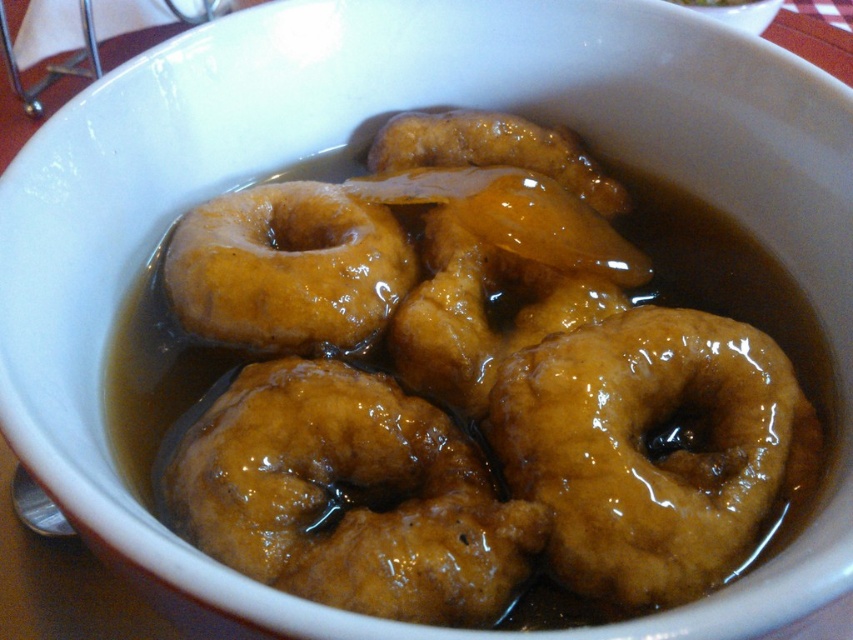
Question: Which object appears closest to the camera in this image?

Choices:
 (A) golden brown glazed donut at center
 (B) glossy golden donut at center

Answer: (B)

Question: Based on their relative distances, which object is nearer to the glossy golden donut at center?

Choices:
 (A) golden glazed donut at center
 (B) golden brown glazed donut at center

Answer: (B)

Question: Does golden brown glazed donut at center have a lesser width compared to golden glazed donut at center?

Choices:
 (A) yes
 (B) no

Answer: (A)

Question: From the image, what is the correct spatial relationship of golden brown glazed donut at center in relation to golden glazed donut at center?

Choices:
 (A) left
 (B) right

Answer: (B)

Question: Based on their relative distances, which object is nearer to the glossy golden donut at center?

Choices:
 (A) golden brown glazed donut at center
 (B) golden glazed donut at center

Answer: (A)

Question: Is glossy golden donut at center bigger than golden brown glazed donut at center?

Choices:
 (A) yes
 (B) no

Answer: (A)